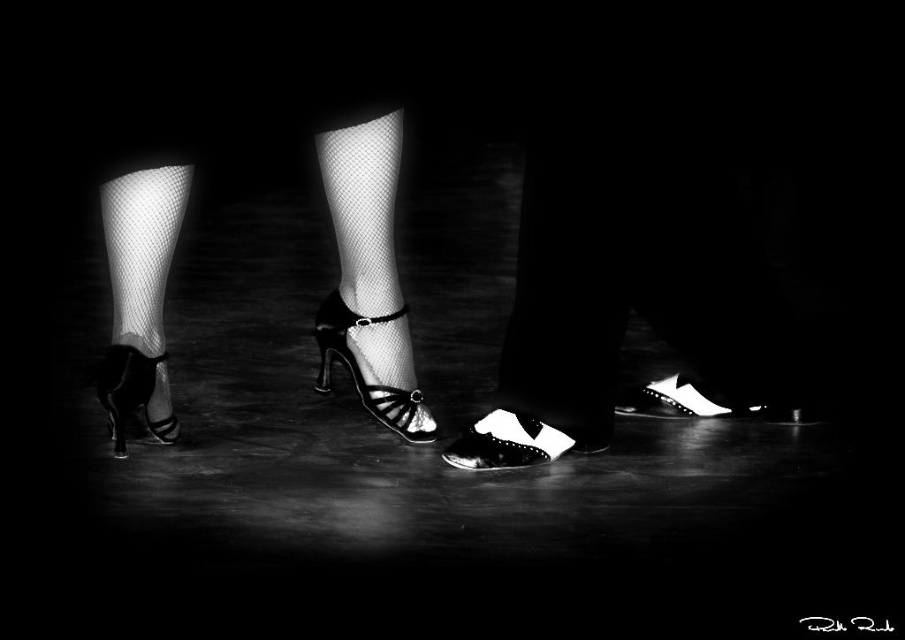
You are standing at point point (524, 460) and want to take a photo of the dancers in the scene. The camera you have can focus on subjects within 5 feet. Will the camera be able to focus on the dancers?

The distance between point (524, 460) and the camera is 5.83 feet, which is beyond the camera focus range of 5 feet. Therefore, the camera will not be able to focus on the dancers.

You are a photographer setting up a shoot in a dark studio. You want to highlight the contrast between the white leather shoe at lower right and the shiny black sandal at lower left. Based on their positions, which object is closer to the bottom edge of the image?

The white leather shoe at lower right is located below the shiny black sandal at lower left, so it is closer to the bottom edge of the image.